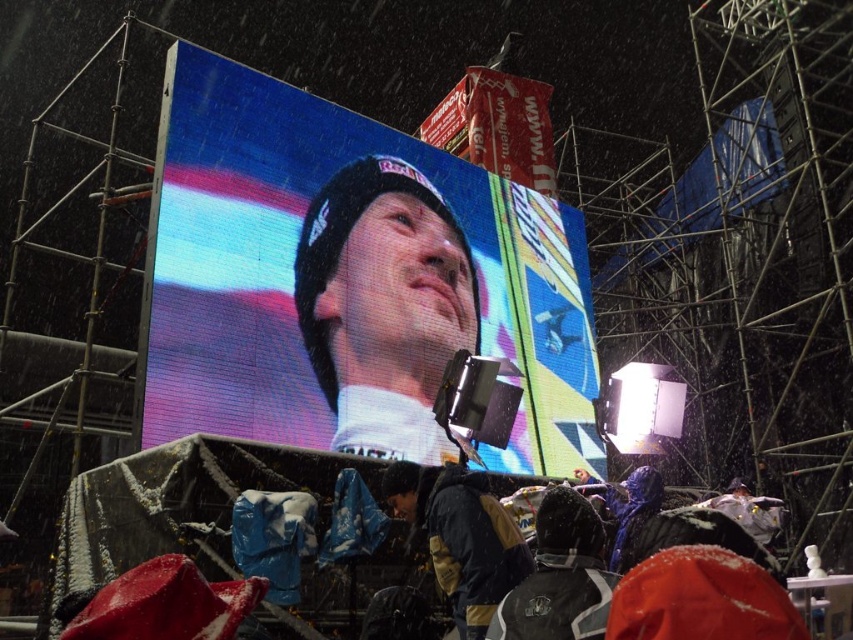
Question: Is matte black beanie at center above raincoat at center?

Choices:
 (A) no
 (B) yes

Answer: (B)

Question: Which point is farther to the camera?

Choices:
 (A) dark blue jacket at center
 (B) raincoat at center
 (C) led display at center
 (D) matte black beanie at center

Answer: (C)

Question: Which object is the farthest from the dark blue jacket at center?

Choices:
 (A) matte black beanie at center
 (B) led display at center
 (C) dark gray jacket at lower center
 (D) raincoat at center

Answer: (B)

Question: Estimate the real-world distances between objects in this image. Which object is farther from the dark gray jacket at lower center?

Choices:
 (A) dark blue jacket at center
 (B) led display at center

Answer: (B)

Question: Is the position of led display at center more distant than that of raincoat at center?

Choices:
 (A) yes
 (B) no

Answer: (A)

Question: Does led display at center have a larger size compared to dark blue jacket at center?

Choices:
 (A) no
 (B) yes

Answer: (A)